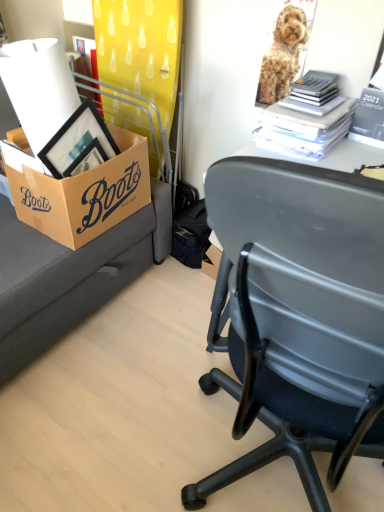
Question: In terms of width, does black paper calendar at upper right, the first book viewed from the right, look wider or thinner when compared to white paper stack at upper right, which is the second book in right-to-left order?

Choices:
 (A) wide
 (B) thin

Answer: (B)

Question: From their relative heights in the image, would you say black paper calendar at upper right, arranged as the 2th book when viewed from the left, is taller or shorter than white paper stack at upper right, which is the second book in right-to-left order?

Choices:
 (A) short
 (B) tall

Answer: (B)

Question: Estimate the real-world distances between objects in this image. Which object is closer to the brown cardboard box at left?

Choices:
 (A) white paper stack at upper right, which is the second book in right-to-left order
 (B) black paper calendar at upper right, the first book viewed from the right
 (C) golden fur dog at upper right

Answer: (A)

Question: Which is nearer to the brown cardboard box at left?

Choices:
 (A) black paper calendar at upper right, arranged as the 2th book when viewed from the left
 (B) golden fur dog at upper right
 (C) white paper stack at upper right, which is the second book in right-to-left order

Answer: (C)